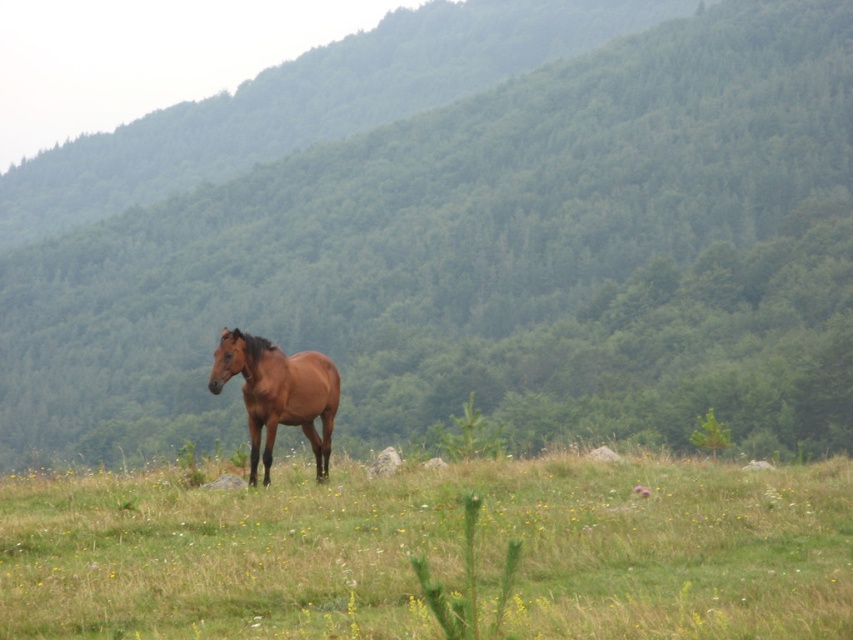
Question: From the image, what is the correct spatial relationship of green grass at center in relation to brown glossy horse at center?

Choices:
 (A) right
 (B) left

Answer: (A)

Question: Which point appears farthest from the camera in this image?

Choices:
 (A) (79, 410)
 (B) (445, 516)

Answer: (A)

Question: Does green forested mountain at center come behind green grass at center?

Choices:
 (A) no
 (B) yes

Answer: (B)

Question: Which of the following is the closest to the observer?

Choices:
 (A) (718, 580)
 (B) (345, 323)

Answer: (A)

Question: Can you confirm if green forested mountain at center is smaller than green grass at center?

Choices:
 (A) yes
 (B) no

Answer: (B)

Question: Among these points, which one is nearest to the camera?

Choices:
 (A) [433, 262]
 (B) [257, 397]
 (C) [367, 561]

Answer: (C)